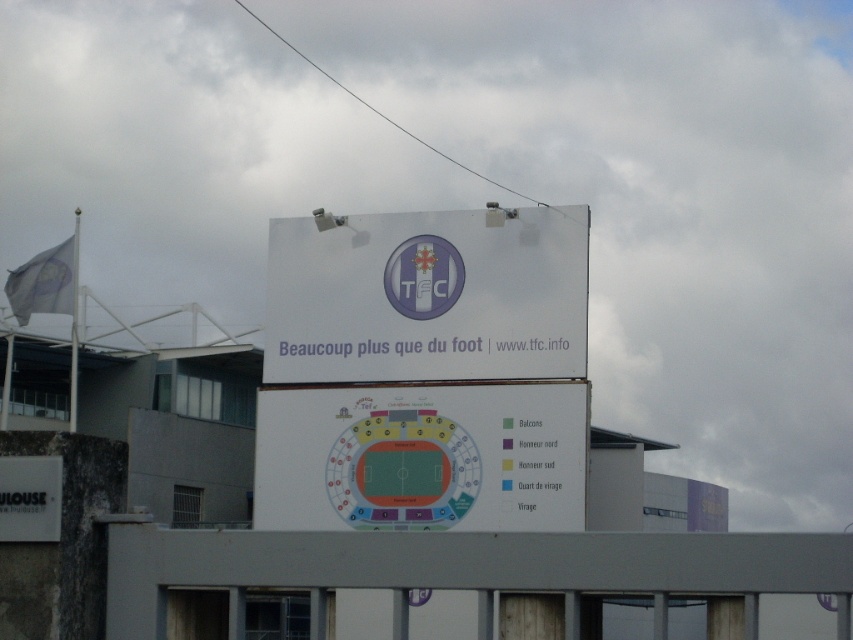
Question: Can you confirm if white paper sign at center is wider than white matte sign at lower left?

Choices:
 (A) no
 (B) yes

Answer: (B)

Question: Does white paper sign at center appear under white paper at center?

Choices:
 (A) no
 (B) yes

Answer: (A)

Question: Does white paper at center have a lesser width compared to white matte sign at lower left?

Choices:
 (A) yes
 (B) no

Answer: (B)

Question: Which point is farther from the camera taking this photo?

Choices:
 (A) (27, 515)
 (B) (543, 330)

Answer: (B)

Question: Which object appears closest to the camera in this image?

Choices:
 (A) white paper sign at center
 (B) white matte sign at lower left
 (C) white paper at center

Answer: (B)

Question: Among these points, which one is nearest to the camera?

Choices:
 (A) click(x=354, y=413)
 (B) click(x=494, y=262)
 (C) click(x=36, y=486)

Answer: (C)